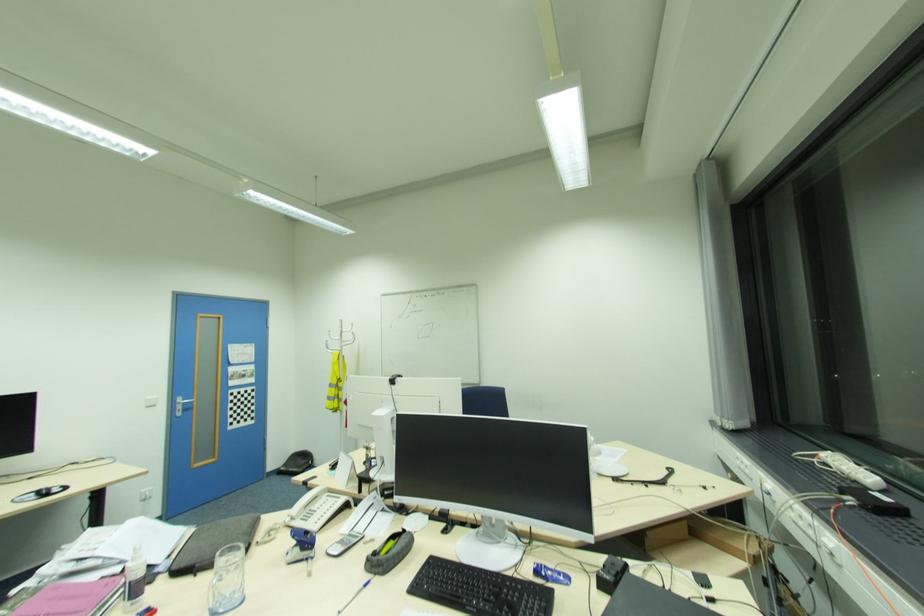
Identify the location of telephone handset. The height and width of the screenshot is (616, 924). (306, 500).